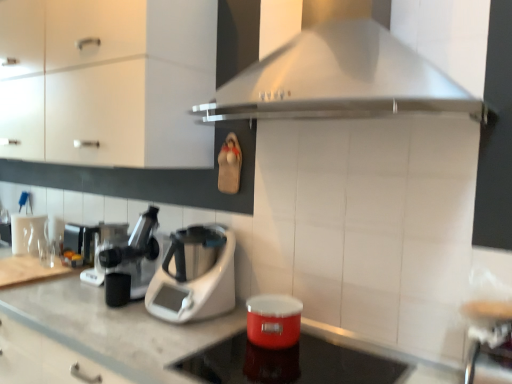
Question: Can you confirm if metallic silver coffee machine at left, the third coffee machine in the right-to-left sequence, is thinner than matte white cabinet at upper left?

Choices:
 (A) no
 (B) yes

Answer: (B)

Question: Is metallic silver coffee machine at left, which is counted as the third coffee machine, starting from the front, positioned before matte white cabinet at upper left?

Choices:
 (A) no
 (B) yes

Answer: (A)

Question: Can you confirm if metallic silver coffee machine at left, the third coffee machine in the right-to-left sequence, is shorter than matte white cabinet at upper left?

Choices:
 (A) no
 (B) yes

Answer: (B)

Question: Can you confirm if metallic silver coffee machine at left, which is counted as the third coffee machine, starting from the front, is bigger than matte white cabinet at upper left?

Choices:
 (A) no
 (B) yes

Answer: (A)

Question: Could you tell me if metallic silver coffee machine at left, which is the 1th coffee machine from back to front, is facing matte white cabinet at upper left?

Choices:
 (A) no
 (B) yes

Answer: (A)

Question: Considering the positions of white plastic food processor at center and metallic silver bar stool at lower right in the image, is white plastic food processor at center taller or shorter than metallic silver bar stool at lower right?

Choices:
 (A) short
 (B) tall

Answer: (B)

Question: From a real-world perspective, is white plastic food processor at center physically located above or below metallic silver bar stool at lower right?

Choices:
 (A) above
 (B) below

Answer: (A)

Question: Considering their positions, is white plastic food processor at center located in front of or behind metallic silver bar stool at lower right?

Choices:
 (A) front
 (B) behind

Answer: (B)

Question: Considering the positions of white plastic food processor at center and metallic silver bar stool at lower right in the image, is white plastic food processor at center wider or thinner than metallic silver bar stool at lower right?

Choices:
 (A) thin
 (B) wide

Answer: (B)

Question: Is matte white cabinet at upper left taller or shorter than white plastic coffee machine at center, placed as the third coffee machine when sorted from left to right?

Choices:
 (A) tall
 (B) short

Answer: (A)

Question: Considering the relative positions of matte white cabinet at upper left and white plastic coffee machine at center, which appears as the first coffee machine when viewed from the right, in the image provided, is matte white cabinet at upper left to the left or to the right of white plastic coffee machine at center, which appears as the first coffee machine when viewed from the right,?

Choices:
 (A) left
 (B) right

Answer: (A)

Question: Considering their positions, is matte white cabinet at upper left located in front of or behind white plastic coffee machine at center, placed as the third coffee machine when sorted from left to right?

Choices:
 (A) front
 (B) behind

Answer: (A)

Question: Based on their sizes in the image, would you say matte white cabinet at upper left is bigger or smaller than white plastic coffee machine at center, placed as the third coffee machine when sorted from left to right?

Choices:
 (A) small
 (B) big

Answer: (B)

Question: Considering the positions of shiny red container at center and metallic silver coffee machine at left, which ranks as the 1th coffee machine in left-to-right order, in the image, is shiny red container at center wider or thinner than metallic silver coffee machine at left, which ranks as the 1th coffee machine in left-to-right order,?

Choices:
 (A) wide
 (B) thin

Answer: (A)

Question: Considering the positions of point (325, 369) and point (73, 225), is point (325, 369) closer or farther from the camera than point (73, 225)?

Choices:
 (A) closer
 (B) farther

Answer: (A)